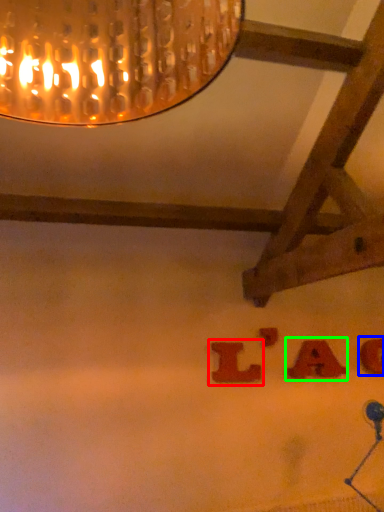
Question: Considering the real-world distances, which object is closest to alphabet (highlighted by a red box)? alphabet (highlighted by a blue box) or alphabet (highlighted by a green box).

Choices:
 (A) alphabet
 (B) alphabet

Answer: (B)